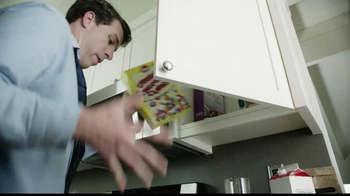
Locate an element on the screen. The width and height of the screenshot is (350, 196). wall is located at coordinates (276, 152), (343, 41).